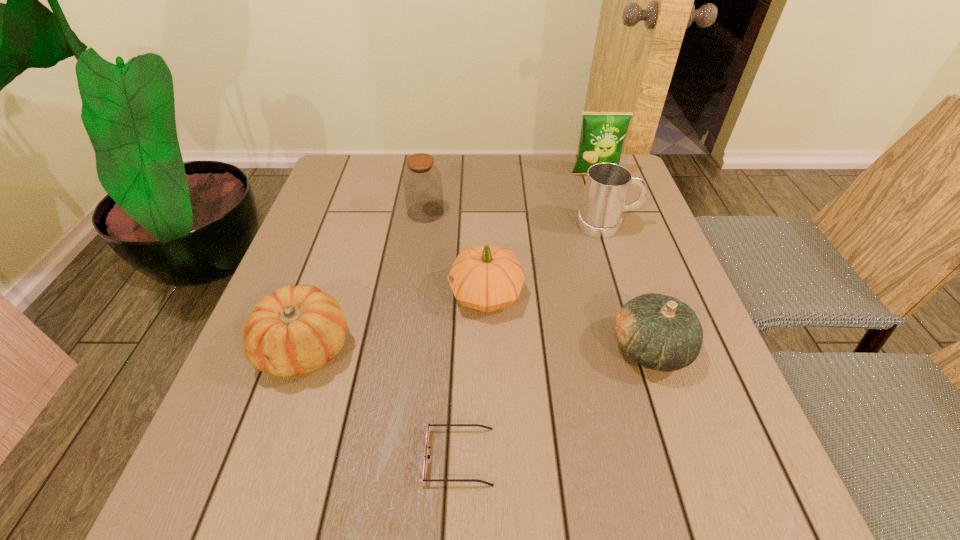
Locate an element on the screen. The width and height of the screenshot is (960, 540). vacant region located on the front of the sixth object from right to left is located at coordinates (418, 263).

Locate an element on the screen. The image size is (960, 540). vacant space located 0.330m on the side of the second gourd from right to left with the carved face is located at coordinates (298, 294).

This screenshot has height=540, width=960. Identify the location of free space located 0.050m on the side of the second gourd from right to left with the carved face. (425, 294).

The height and width of the screenshot is (540, 960). In order to click on vacant space located on the side of the second gourd from right to left with the carved face in this screenshot , I will do `click(397, 294)`.

In order to click on free region located 0.290m on the back of the rightmost gourd in this screenshot , I will do tap(612, 230).

Find the location of a particular element. This screenshot has width=960, height=540. vacant space situated on the back of the leftmost gourd is located at coordinates (346, 228).

I want to click on vacant space positioned on the bridge of the shortest object, so click(623, 456).

Locate an element on the screen. Image resolution: width=960 pixels, height=540 pixels. object located at the far edge is located at coordinates pos(603,133).

Image resolution: width=960 pixels, height=540 pixels. In order to click on object situated at the near edge in this screenshot , I will do `click(424, 479)`.

Locate an element on the screen. The image size is (960, 540). object located in the left edge section of the desktop is located at coordinates (296, 330).